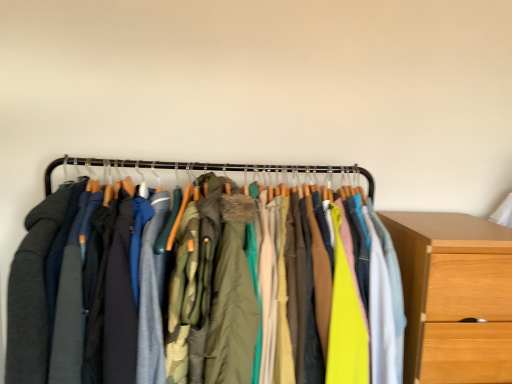
Question: Would you say green textured coat at center is to the left or to the right of textured fabric jackets at center in the picture?

Choices:
 (A) left
 (B) right

Answer: (B)

Question: Considering their positions, is green textured coat at center located in front of or behind textured fabric jackets at center?

Choices:
 (A) behind
 (B) front

Answer: (B)

Question: Which of these objects is positioned farthest from the wooden chest of drawers at right?

Choices:
 (A) textured fabric jackets at center
 (B) green textured coat at center

Answer: (B)

Question: Which is farther from the wooden chest of drawers at right?

Choices:
 (A) green textured coat at center
 (B) textured fabric jackets at center

Answer: (A)